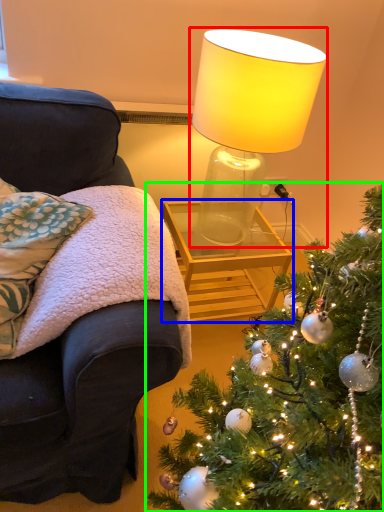
Question: Which object is the farthest from lamp (highlighted by a red box)? Choose among these: table (highlighted by a blue box) or christmas tree (highlighted by a green box).

Choices:
 (A) table
 (B) christmas tree

Answer: (B)